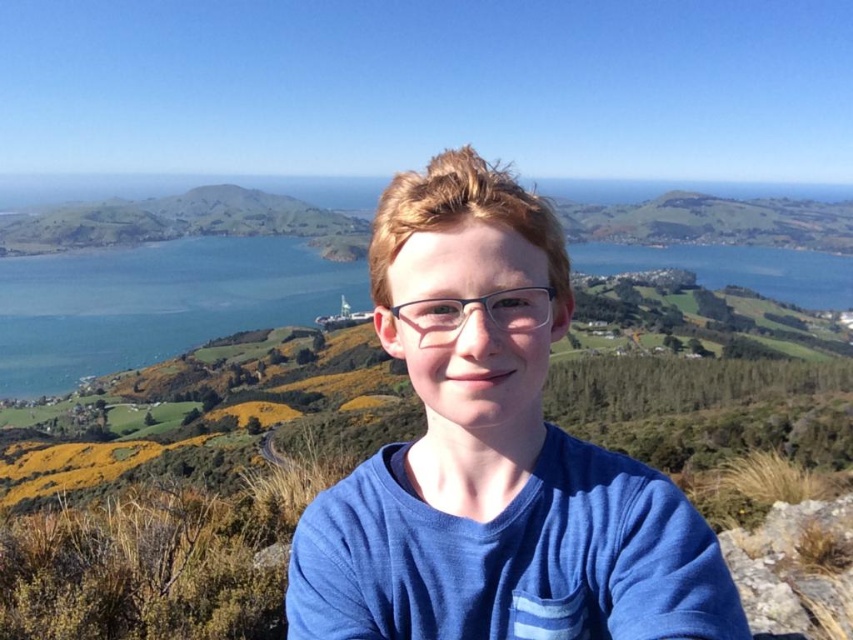
Question: Is blue cotton shirt at center wider than clear plastic glasses at center?

Choices:
 (A) no
 (B) yes

Answer: (B)

Question: Does blue cotton shirt at center have a larger size compared to clear plastic glasses at center?

Choices:
 (A) no
 (B) yes

Answer: (B)

Question: Which point is closer to the camera taking this photo?

Choices:
 (A) (461, 317)
 (B) (462, 156)

Answer: (A)

Question: Can you confirm if blue cotton shirt at center is thinner than clear plastic glasses at center?

Choices:
 (A) no
 (B) yes

Answer: (A)

Question: Among these objects, which one is nearest to the camera?

Choices:
 (A) clear plastic glasses at center
 (B) blue cotton shirt at center

Answer: (B)